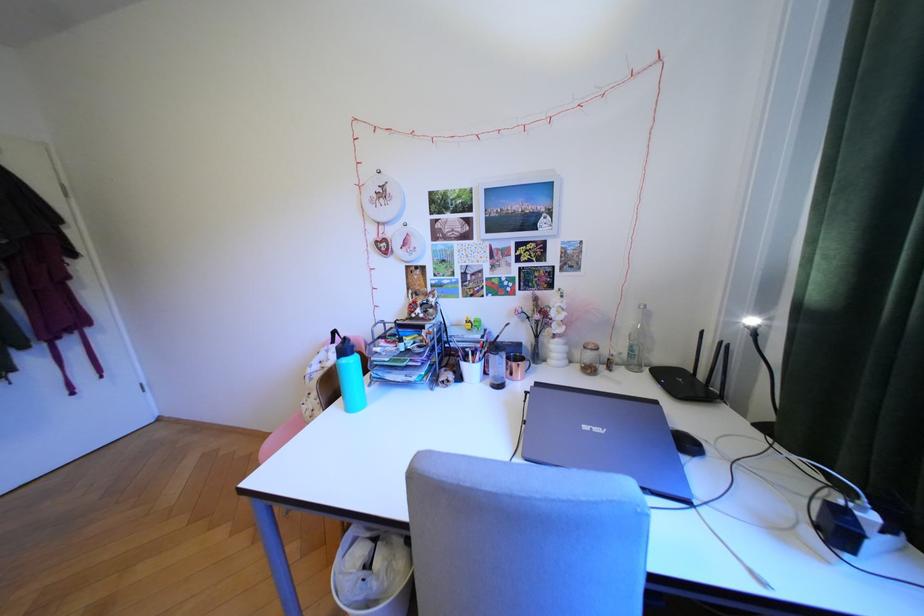
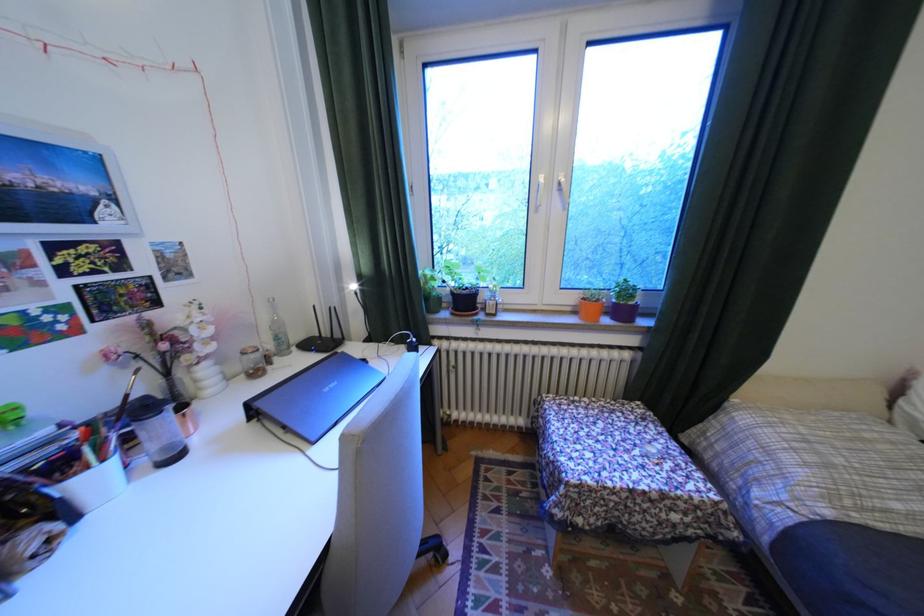
Question: The images are taken continuously from a first-person perspective. In which direction is your viewpoint rotating?

Choices:
 (A) Left
 (B) Right
 (C) Up
 (D) Down

Answer: (B)